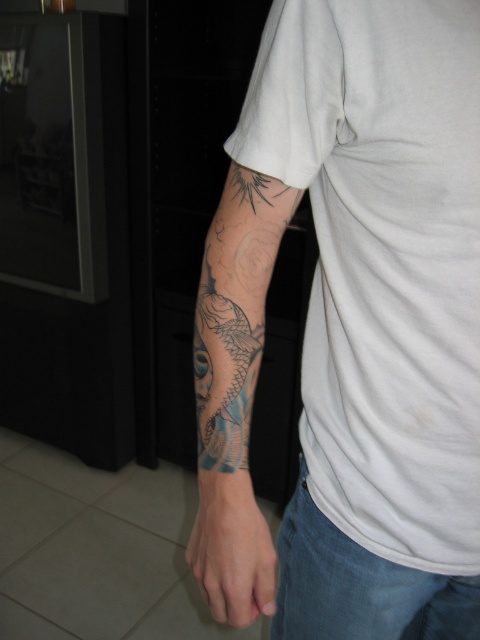
Is white cotton t-shirt at upper right positioned at the back of smooth skin at lower left?

No, it is not.

Does point (420, 273) come farther from viewer compared to point (215, 557)?

No.

Locate an element on the screen. This screenshot has width=480, height=640. white cotton t-shirt at upper right is located at coordinates (383, 260).

Which of these two, white cotton t-shirt at upper right or black ink tattoo at lower left, stands taller?

black ink tattoo at lower left is taller.

Can you confirm if white cotton t-shirt at upper right is taller than black ink tattoo at lower left?

No, white cotton t-shirt at upper right is not taller than black ink tattoo at lower left.

This screenshot has width=480, height=640. In order to click on white cotton t-shirt at upper right in this screenshot , I will do `click(383, 260)`.

Between black ink tattoo at lower left and smooth skin at lower left, which one has less height?

smooth skin at lower left is shorter.

Who is more distant from viewer, [237,356] or [263,596]?

Point [263,596]

Which is in front, point (260, 116) or point (227, 554)?

Positioned in front is point (260, 116).

Where is `black ink tattoo at lower left`? black ink tattoo at lower left is located at coordinates (253, 292).